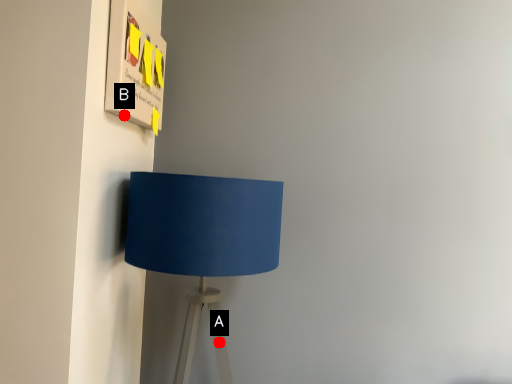
Question: Two points are circled on the image, labeled by A and B beside each circle. Which point is further to the camera?

Choices:
 (A) A is further
 (B) B is further

Answer: (A)